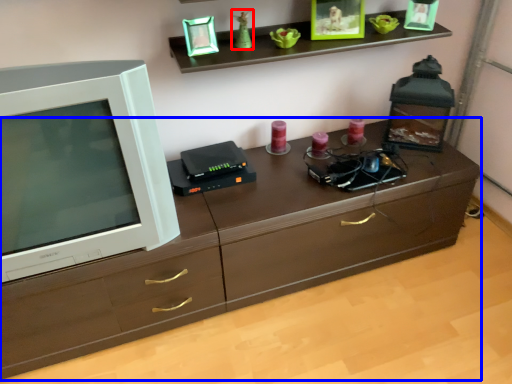
Question: Which of the following is the closest to the observer, toy (highlighted by a red box) or chest of drawers (highlighted by a blue box)?

Choices:
 (A) toy
 (B) chest of drawers

Answer: (B)